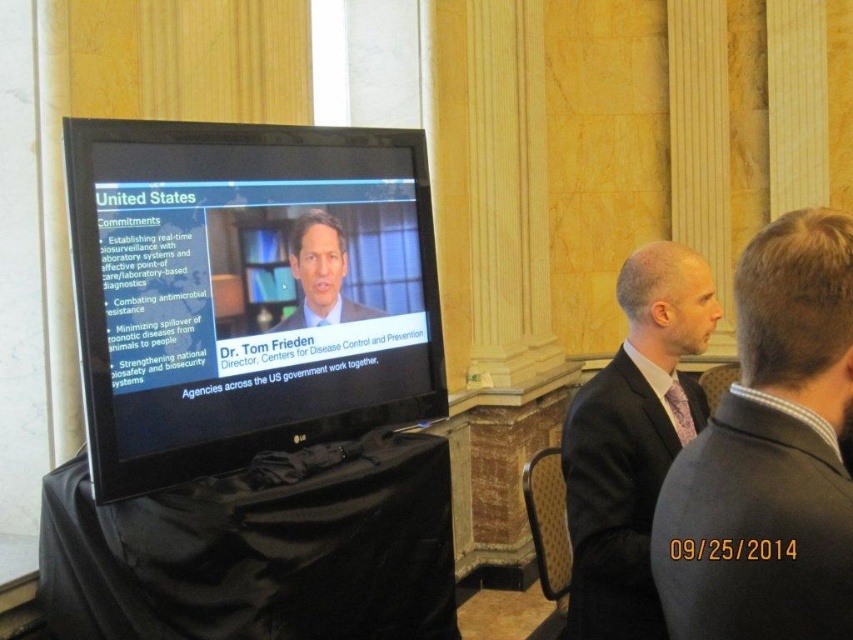
Is dark gray suit at center positioned at the back of blue suit at center?

No, dark gray suit at center is in front of blue suit at center.

Is point (785, 280) positioned in front of point (297, 259)?

Yes.

Image resolution: width=853 pixels, height=640 pixels. In order to click on dark gray suit at center in this screenshot , I will do `click(770, 456)`.

Does black glossy monitor at center appear on the left side of blue suit at center?

Correct, you'll find black glossy monitor at center to the left of blue suit at center.

The width and height of the screenshot is (853, 640). What are the coordinates of `black glossy monitor at center` in the screenshot? It's located at (247, 291).

Where is `black glossy monitor at center`? black glossy monitor at center is located at coordinates (247, 291).

Can you confirm if dark gray suit at center is thinner than dark gray wool suit at center?

Correct, dark gray suit at center's width is less than dark gray wool suit at center's.

Is point (717, 561) less distant than point (581, 582)?

Yes.

Does point (715, 608) come closer to viewer compared to point (590, 460)?

Yes, it is.

Identify the location of dark gray suit at center. The width and height of the screenshot is (853, 640). click(x=770, y=456).